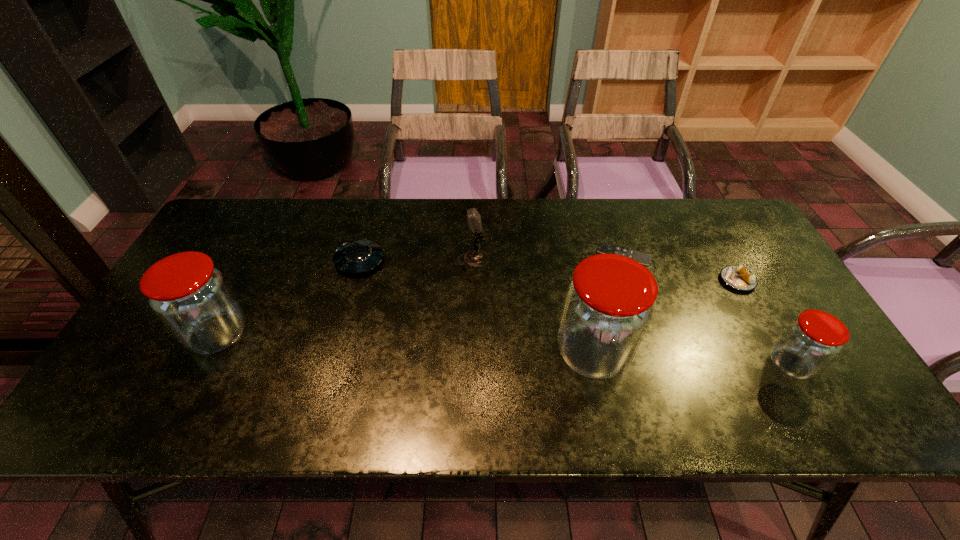
Find the location of a particular element. the leftmost object is located at coordinates (191, 297).

This screenshot has width=960, height=540. In order to click on the second shortest jar in this screenshot , I will do `click(191, 297)`.

At what (x,y) coordinates should I click in order to perform the action: click on the second jar from left to right. Please return your answer as a coordinate pair (x, y). The image size is (960, 540). Looking at the image, I should click on (609, 303).

Locate an element on the screen. The image size is (960, 540). the rightmost jar is located at coordinates (811, 341).

Where is `the fourth tallest object`? The image size is (960, 540). the fourth tallest object is located at coordinates (811, 341).

This screenshot has width=960, height=540. I want to click on the fifth object from right to left, so click(475, 257).

Locate an element on the screen. remote control is located at coordinates (643, 258).

The image size is (960, 540). Identify the location of saucer. (357, 256).

At what (x,y) coordinates should I click in order to perform the action: click on the sixth object from right to left. Please return your answer as a coordinate pair (x, y). Looking at the image, I should click on (357, 256).

You are a GUI agent. You are given a task and a screenshot of the screen. Output one action in this format:
    pyautogui.click(x=<x>, y=<y>)
    Task: Click on the pastry
    
    Given the screenshot: What is the action you would take?
    pyautogui.click(x=737, y=277)